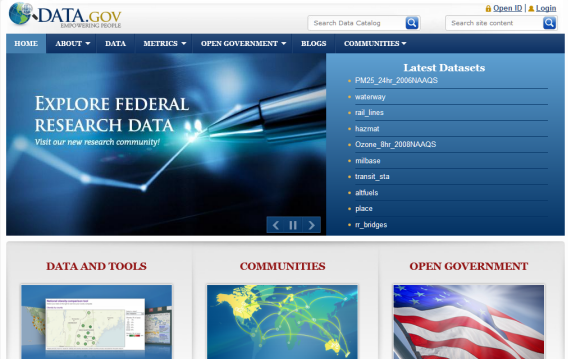
The image size is (568, 359). What are the coordinates of `pen` in the screenshot? It's located at (291, 107).